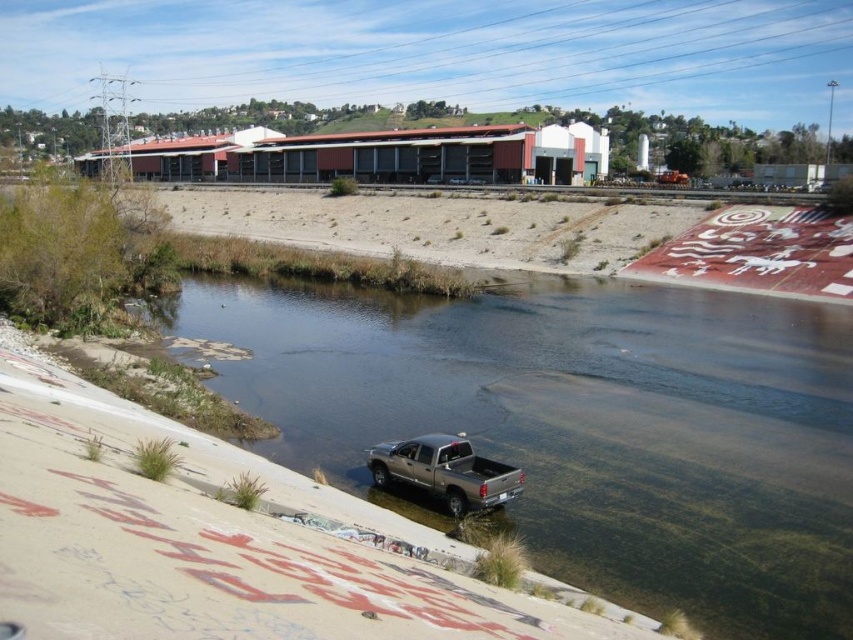
Question: Which of the following is the farthest from the observer?

Choices:
 (A) clear water at center
 (B) silver metallic truck at lower center

Answer: (B)

Question: Can you confirm if clear water at center is wider than silver metallic truck at lower center?

Choices:
 (A) no
 (B) yes

Answer: (B)

Question: Which object is closer to the camera taking this photo?

Choices:
 (A) clear water at center
 (B) silver metallic truck at lower center

Answer: (A)

Question: Which point is closer to the camera?

Choices:
 (A) (463, 435)
 (B) (242, 368)

Answer: (A)

Question: Can you confirm if clear water at center is thinner than silver metallic truck at lower center?

Choices:
 (A) yes
 (B) no

Answer: (B)

Question: In this image, where is clear water at center located relative to silver metallic truck at lower center?

Choices:
 (A) above
 (B) below

Answer: (A)